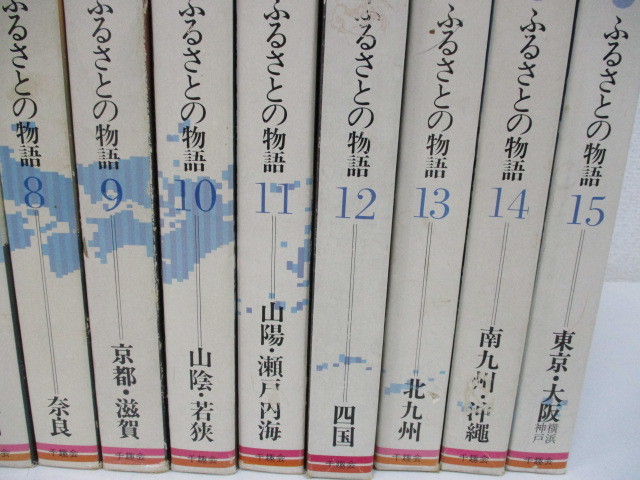
This screenshot has height=480, width=640. Find the location of `shelf`. shelf is located at coordinates (612, 353).